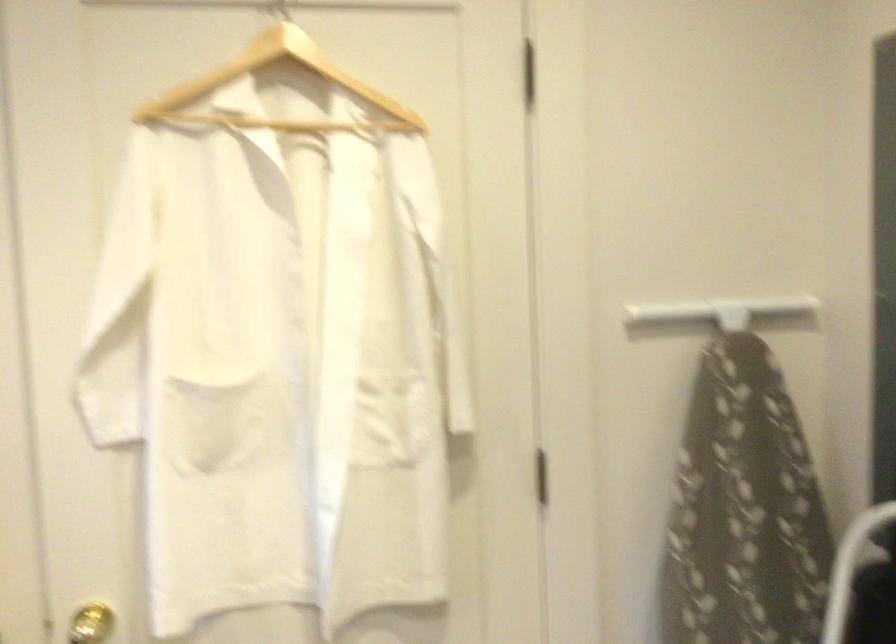
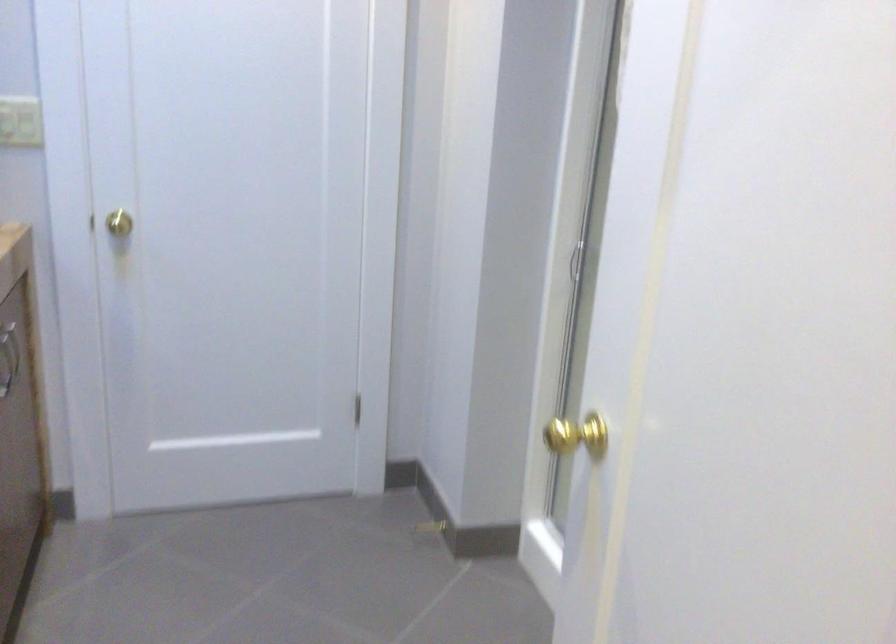
Question: Based on the continuous images, in which direction is the camera rotating? Reply with the corresponding letter.

Choices:
 (A) Left
 (B) Right
 (C) Up
 (D) Down

Answer: (B)